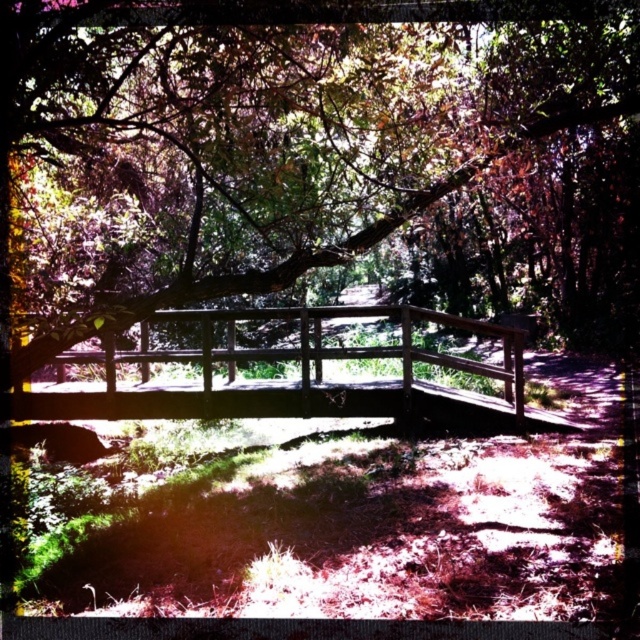
Question: Can you confirm if green leafy tree at center is positioned below wooden bridge at center?

Choices:
 (A) yes
 (B) no

Answer: (B)

Question: Among these objects, which one is nearest to the camera?

Choices:
 (A) wooden bridge at center
 (B) green leafy tree at center

Answer: (B)

Question: From the image, what is the correct spatial relationship of green leafy tree at center in relation to wooden bridge at center?

Choices:
 (A) below
 (B) above

Answer: (B)

Question: Which point appears closest to the camera in this image?

Choices:
 (A) (515, 352)
 (B) (100, 253)

Answer: (A)

Question: Does green leafy tree at center appear over wooden bridge at center?

Choices:
 (A) yes
 (B) no

Answer: (A)